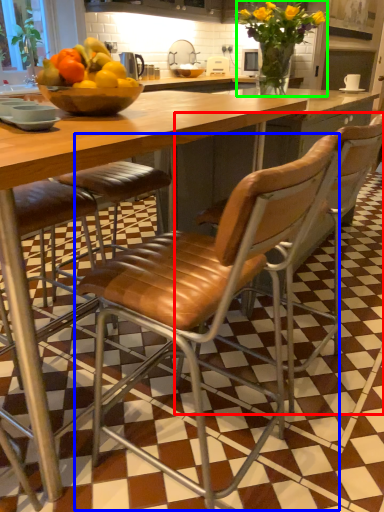
Question: Which is nearer to the chair (highlighted by a red box)? chair (highlighted by a blue box) or flower (highlighted by a green box).

Choices:
 (A) chair
 (B) flower

Answer: (A)